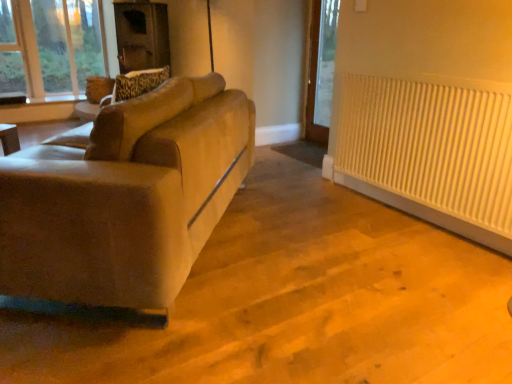
Question: From the image's perspective, is suede-like beige couch at left positioned above or below white ribbed radiator at right?

Choices:
 (A) below
 (B) above

Answer: (A)

Question: Do you think suede-like beige couch at left is within white ribbed radiator at right, or outside of it?

Choices:
 (A) inside
 (B) outside

Answer: (B)

Question: Based on their relative distances, which object is nearer to the suede-like beige couch at left?

Choices:
 (A) white ribbed radiator at right
 (B) beige fabric swivel chair at left

Answer: (B)

Question: Which of these objects is positioned closest to the beige fabric swivel chair at left?

Choices:
 (A) white ribbed radiator at right
 (B) suede-like beige couch at left

Answer: (B)